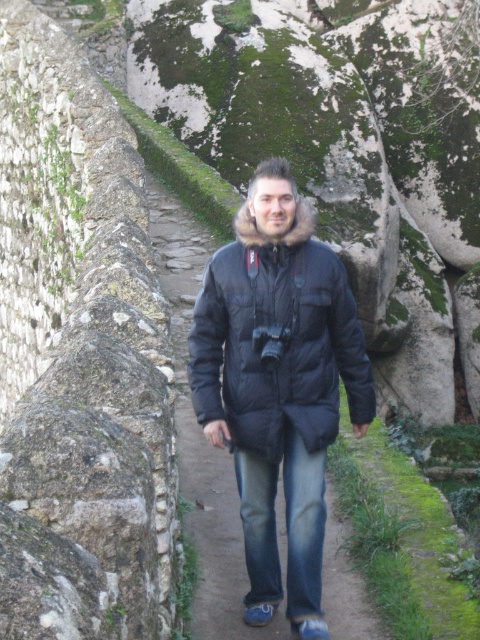
Is black matte jacket at center above denim jeans at center?

Indeed, black matte jacket at center is positioned over denim jeans at center.

Does black matte jacket at center have a greater width compared to denim jeans at center?

Indeed, black matte jacket at center has a greater width compared to denim jeans at center.

Is point (197, 534) positioned before point (269, 493)?

No, (197, 534) is behind (269, 493).

I want to click on black matte jacket at center, so click(x=202, y=440).

Is matte black jacket at center shorter than black matte jacket at center?

Correct, matte black jacket at center is not as tall as black matte jacket at center.

This screenshot has width=480, height=640. What are the coordinates of `matte black jacket at center` in the screenshot? It's located at (277, 339).

Describe the element at coordinates (277, 339) in the screenshot. I see `matte black jacket at center` at that location.

You are a GUI agent. You are given a task and a screenshot of the screen. Output one action in this format:
    pyautogui.click(x=<x>, y=<y>)
    Task: Click on the matte black jacket at center
    
    Given the screenshot: What is the action you would take?
    pyautogui.click(x=277, y=339)

Does matte black jacket at center come in front of denim jeans at center?

No, it is behind denim jeans at center.

Is matte black jacket at center further to camera compared to denim jeans at center?

Yes, matte black jacket at center is further from the viewer.

Is point (276, 387) behind point (260, 556)?

Yes, it is behind point (260, 556).

You are a GUI agent. You are given a task and a screenshot of the screen. Output one action in this format:
    pyautogui.click(x=<x>, y=<y>)
    Task: Click on the matte black jacket at center
    This screenshot has width=480, height=640.
    Given the screenshot: What is the action you would take?
    pyautogui.click(x=277, y=339)